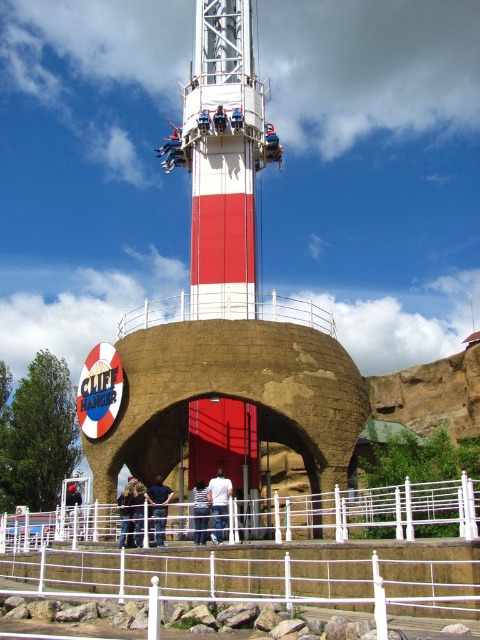
You are a visitor at the amusement park and want to take a photo of the Cliff Hanger ride. You notice the white metal fence at lower center and the brown fabric jacket at center. Which object is closer to the camera?

The white metal fence at lower center is positioned under the brown fabric jacket at center, meaning it is closer to the camera.

You are a visitor standing in front of the Cliff Hanger ride and see both the dark blue shirt at center and the blue fabric seat at center. Which object is nearer to you?

The dark blue shirt at center is closer to the viewer than the blue fabric seat at center.

You are a visitor standing at the entrance of the Cliff Hanger ride and see the white metal fence at lower center and the brown fabric jacket at center. Which object is nearer to you?

The white metal fence at lower center is closer to the viewer than the brown fabric jacket at center, so the white metal fence at lower center is nearer to you.